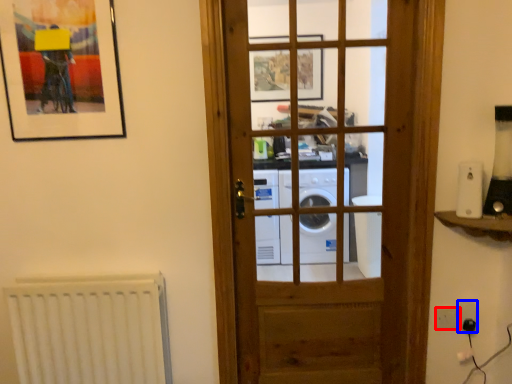
Question: Which object is closer to the camera taking this photo, light switch (highlighted by a red box) or electric outlet (highlighted by a blue box)?

Choices:
 (A) light switch
 (B) electric outlet

Answer: (B)